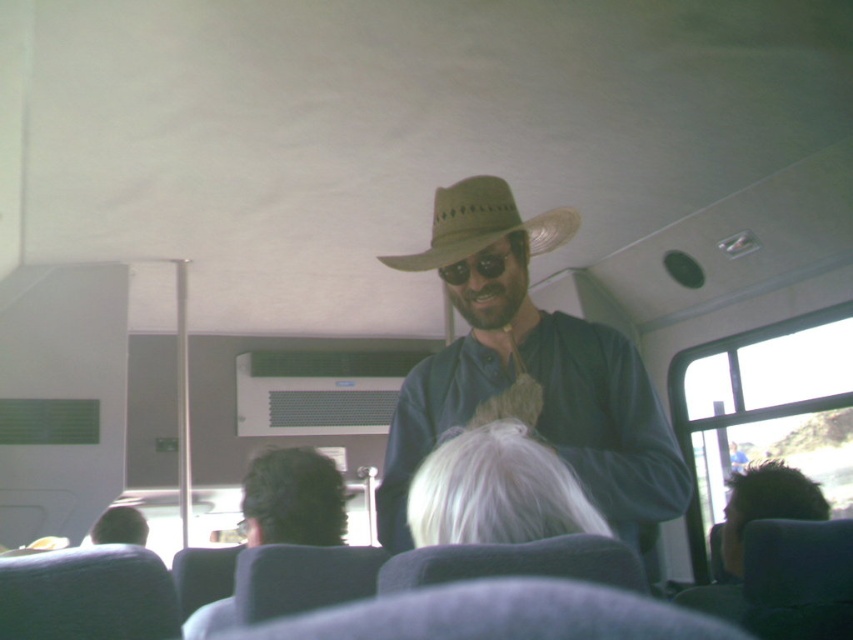
Question: Does dark brown hair at center have a greater width compared to black matte sunglasses at center?

Choices:
 (A) no
 (B) yes

Answer: (B)

Question: Can you confirm if black matte sunglasses at center is positioned above dark brown hair at lower left?

Choices:
 (A) yes
 (B) no

Answer: (A)

Question: From the image, what is the correct spatial relationship of dark brown hair at center in relation to tan straw hat at center?

Choices:
 (A) above
 (B) below

Answer: (B)

Question: Among these objects, which one is nearest to the camera?

Choices:
 (A) tan straw hat at center
 (B) dark brown hair at center
 (C) matte straw hat at center
 (D) black matte sunglasses at center

Answer: (C)

Question: Which of the following is the farthest from the observer?

Choices:
 (A) (115, 509)
 (B) (514, 260)
 (C) (502, 317)
 (D) (412, 257)

Answer: (A)

Question: Which object appears closest to the camera in this image?

Choices:
 (A) black matte sunglasses at center
 (B) dark brown hair at center
 (C) dark brown hair at lower left

Answer: (B)